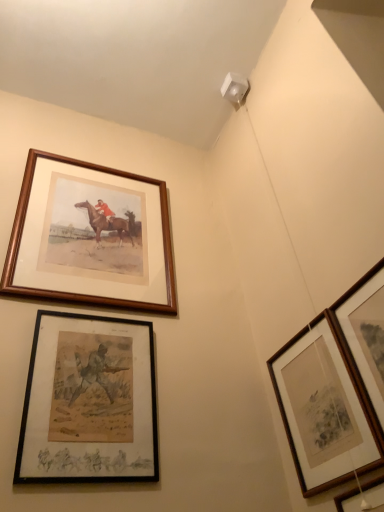
Question: Can we say wooden picture frame at upper right, marked as the fifth picture frame in a left-to-right arrangement, lies outside wooden framed print at lower right, which is the third picture frame in right-to-left order?

Choices:
 (A) yes
 (B) no

Answer: (A)

Question: From a real-world perspective, is wooden picture frame at upper right, marked as the fifth picture frame in a left-to-right arrangement, positioned under wooden framed print at lower right, which is the third picture frame in right-to-left order, based on gravity?

Choices:
 (A) no
 (B) yes

Answer: (B)

Question: Is there a large distance between wooden picture frame at upper right, marked as the fifth picture frame in a left-to-right arrangement, and wooden framed print at lower right, which is the third picture frame in right-to-left order?

Choices:
 (A) yes
 (B) no

Answer: (B)

Question: Considering the relative sizes of wooden picture frame at upper right, marked as the first picture frame in a right-to-left arrangement, and wooden framed print at lower right, which appears as the 3th picture frame when viewed from the left, in the image provided, is wooden picture frame at upper right, marked as the first picture frame in a right-to-left arrangement, taller than wooden framed print at lower right, which appears as the 3th picture frame when viewed from the left,?

Choices:
 (A) no
 (B) yes

Answer: (A)

Question: From the image's perspective, does wooden picture frame at upper right, marked as the first picture frame in a right-to-left arrangement, appear lower than wooden framed print at lower right, which appears as the 3th picture frame when viewed from the left?

Choices:
 (A) yes
 (B) no

Answer: (B)

Question: Is wooden picture frame at upper right, marked as the fifth picture frame in a left-to-right arrangement, positioned with its back to wooden framed print at lower right, which is the third picture frame in right-to-left order?

Choices:
 (A) no
 (B) yes

Answer: (A)

Question: Is wooden frame at upper left, which appears as the first picture frame when viewed from the left, not close to wooden picture frame at upper right, marked as the first picture frame in a right-to-left arrangement?

Choices:
 (A) yes
 (B) no

Answer: (B)

Question: From the image's perspective, does wooden frame at upper left, the fifth picture frame in the right-to-left sequence, appear lower than wooden picture frame at upper right, marked as the first picture frame in a right-to-left arrangement?

Choices:
 (A) yes
 (B) no

Answer: (B)

Question: Is wooden frame at upper left, the fifth picture frame in the right-to-left sequence, beside wooden picture frame at upper right, marked as the fifth picture frame in a left-to-right arrangement?

Choices:
 (A) yes
 (B) no

Answer: (B)

Question: From a real-world perspective, does wooden frame at upper left, the fifth picture frame in the right-to-left sequence, sit lower than wooden picture frame at upper right, marked as the first picture frame in a right-to-left arrangement?

Choices:
 (A) no
 (B) yes

Answer: (A)

Question: Is wooden frame at upper left, the fifth picture frame in the right-to-left sequence, positioned beyond the bounds of wooden picture frame at upper right, marked as the fifth picture frame in a left-to-right arrangement?

Choices:
 (A) yes
 (B) no

Answer: (A)

Question: Does wooden frame at upper left, which appears as the first picture frame when viewed from the left, have a larger size compared to wooden picture frame at upper right, marked as the fifth picture frame in a left-to-right arrangement?

Choices:
 (A) yes
 (B) no

Answer: (A)

Question: Is wooden picture frame at lower right, arranged as the second picture frame when viewed from the right, turned away from black matte picture frame at lower left, which ranks as the 4th picture frame in right-to-left order?

Choices:
 (A) yes
 (B) no

Answer: (B)